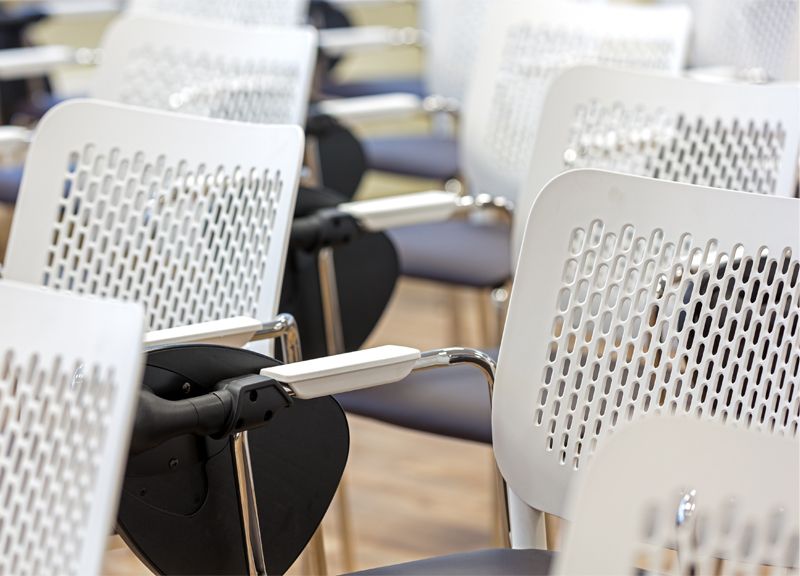
Identify the location of chair backs. Image resolution: width=800 pixels, height=576 pixels. (250, 12), (236, 58), (182, 166), (78, 366), (664, 359), (653, 132), (554, 65), (458, 40), (770, 39).